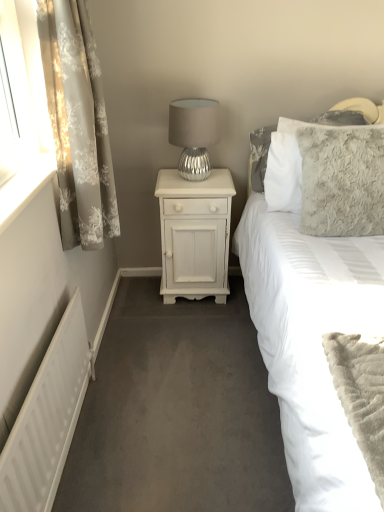
Question: Is fluffy gray pillow at upper right taller or shorter than white painted wood nightstand at center?

Choices:
 (A) tall
 (B) short

Answer: (A)

Question: From the image's perspective, is fluffy gray pillow at upper right located above or below white painted wood nightstand at center?

Choices:
 (A) below
 (B) above

Answer: (A)

Question: Which is nearer to the white matte radiator at lower left?

Choices:
 (A) floral sheer curtain at left
 (B) silver metallic table lamp at upper center
 (C) fluffy gray pillow at upper right
 (D) fluffy gray pillow at upper right
 (E) white painted wood nightstand at center

Answer: (A)

Question: Which of these objects is positioned farthest from the floral sheer curtain at left?

Choices:
 (A) silver metallic table lamp at upper center
 (B) white matte radiator at lower left
 (C) white painted wood nightstand at center
 (D) fluffy gray pillow at upper right
 (E) fluffy gray pillow at upper right

Answer: (E)